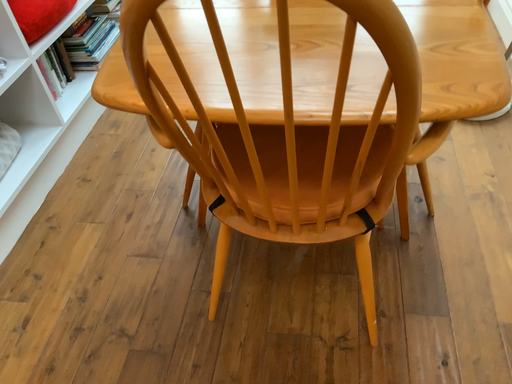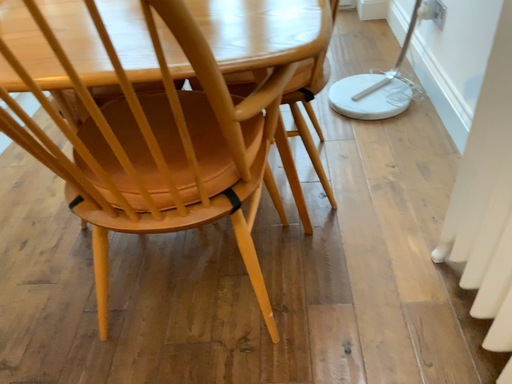
Question: How did the camera likely rotate when shooting the video?

Choices:
 (A) rotated upward
 (B) rotated downward

Answer: (A)